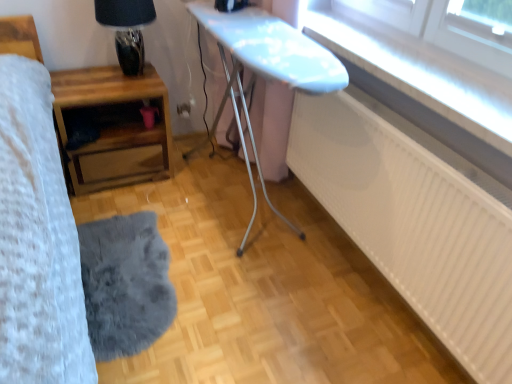
Where is `vacant area that is in front of white glossy ironing board at center, which appears as the first table when viewed from the right`? vacant area that is in front of white glossy ironing board at center, which appears as the first table when viewed from the right is located at coordinates (226, 321).